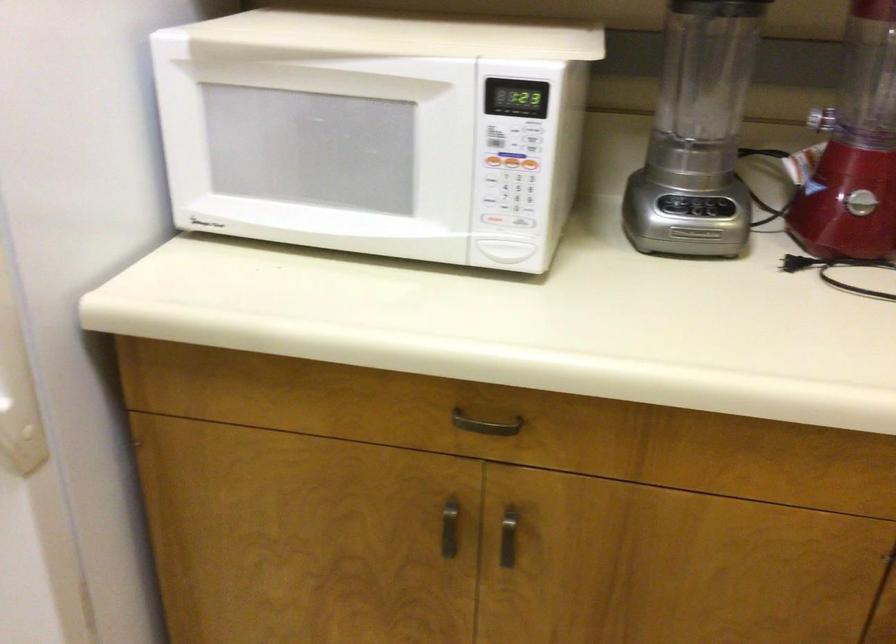
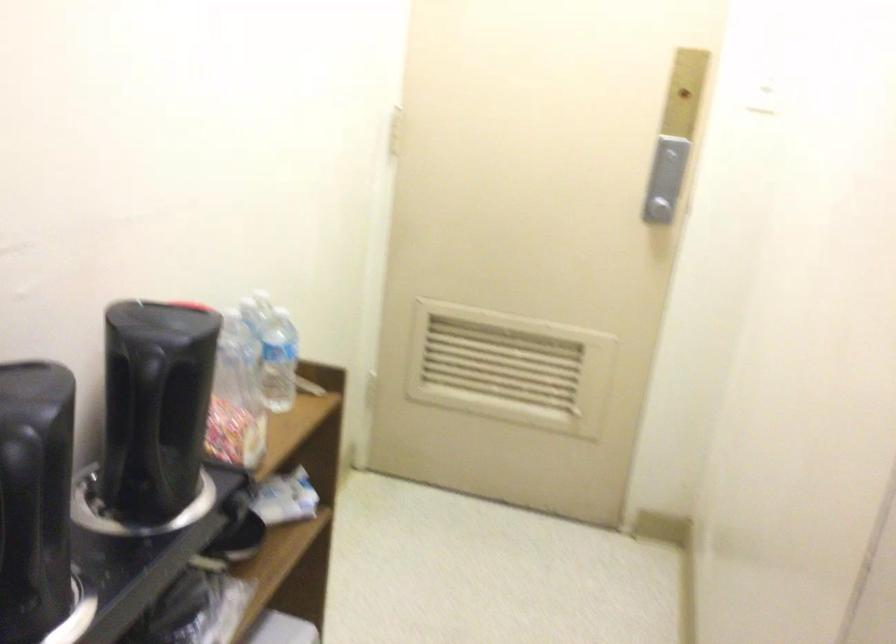
Question: The first image is from the beginning of the video and the second image is from the end. How did the camera likely rotate when shooting the video?

Choices:
 (A) Left
 (B) Right
 (C) Up
 (D) Down

Answer: (A)